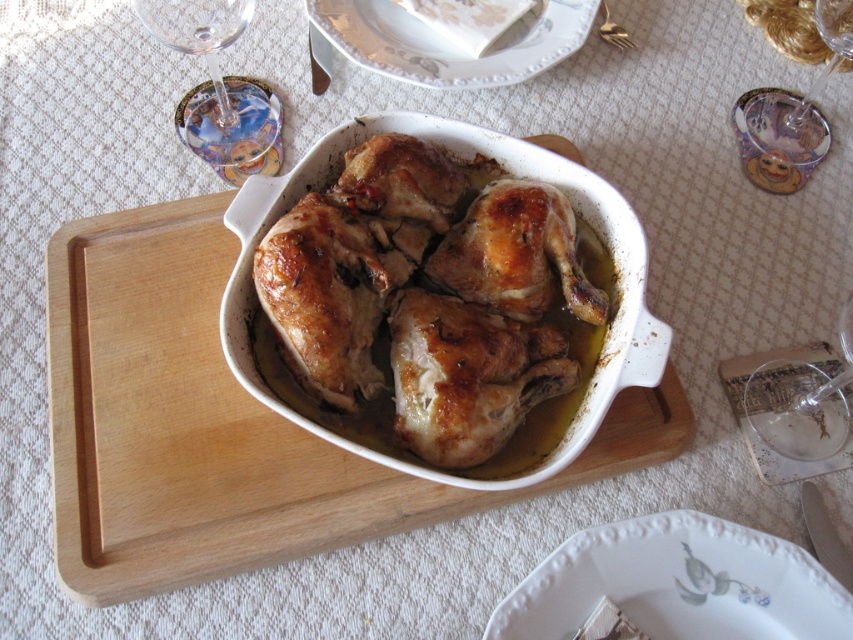
Does white porcelain plate at upper center have a greater height compared to transparent glass at upper right?

No, white porcelain plate at upper center is not taller than transparent glass at upper right.

Can you confirm if white porcelain plate at upper center is shorter than transparent glass at upper right?

Correct, white porcelain plate at upper center is not as tall as transparent glass at upper right.

Is point (329, 42) farther from camera compared to point (793, 120)?

No, it is in front of (793, 120).

The image size is (853, 640). I want to click on white porcelain plate at upper center, so click(x=445, y=42).

Does point (822, 372) come behind point (621, 44)?

No.

Is point (828, 403) behind point (630, 44)?

No, (828, 403) is closer to viewer.

You are a GUI agent. You are given a task and a screenshot of the screen. Output one action in this format:
    pyautogui.click(x=<x>, y=<y>)
    Task: Click on the transparent glass at lower right
    This screenshot has width=853, height=640.
    Given the screenshot: What is the action you would take?
    pyautogui.click(x=801, y=403)

Does white porcelain plate at lower center appear under transparent glass at lower right?

Indeed, white porcelain plate at lower center is positioned under transparent glass at lower right.

The image size is (853, 640). I want to click on white porcelain plate at lower center, so tap(677, 582).

Locate an element on the screen. The height and width of the screenshot is (640, 853). white porcelain plate at lower center is located at coordinates (677, 582).